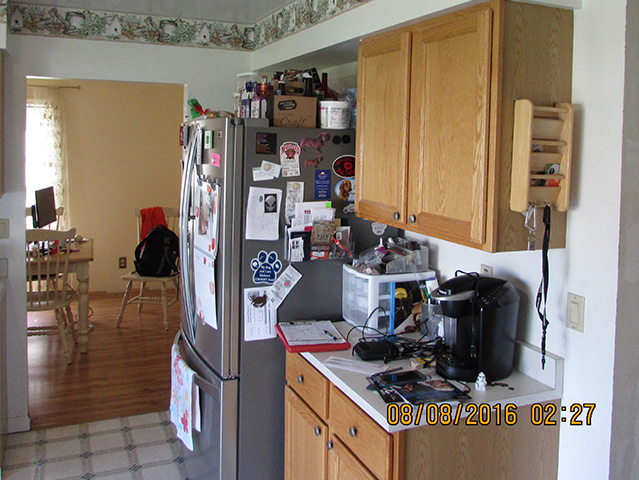
Locate an element on the screen. The width and height of the screenshot is (639, 480). ceramic floor is located at coordinates (124, 451).